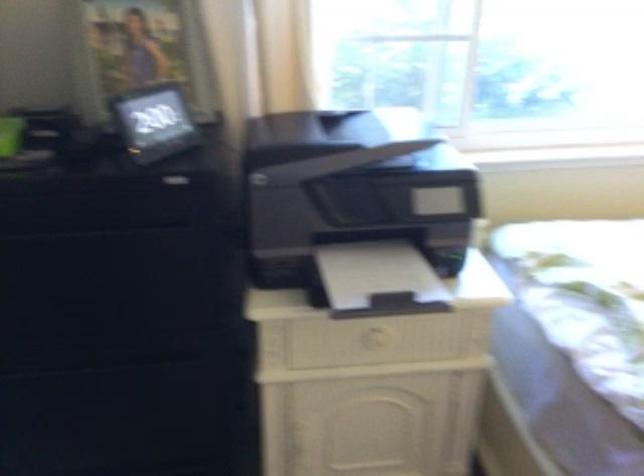
This screenshot has width=644, height=476. What are the coordinates of `white drawer knob` in the screenshot? It's located at (375, 338).